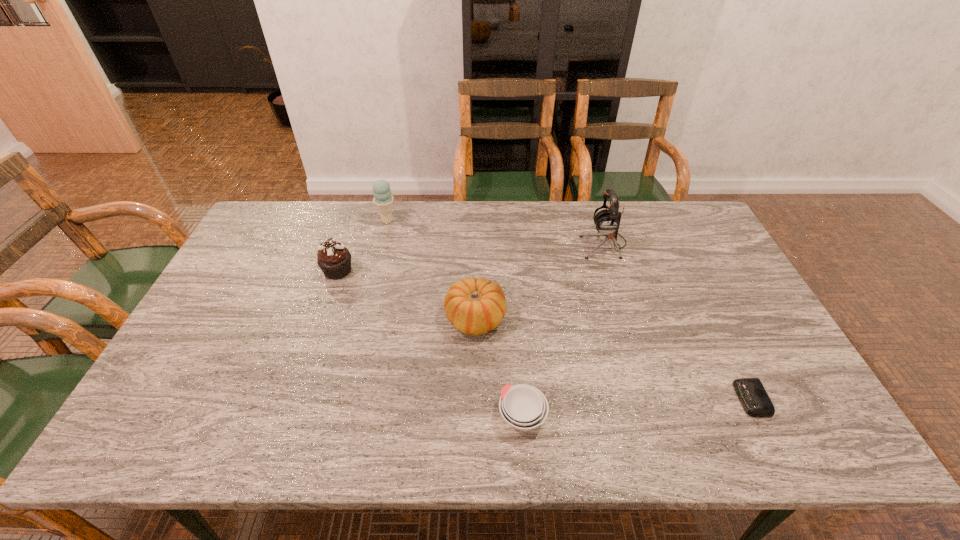
In order to click on the second object from right to left in this screenshot , I will do `click(607, 221)`.

Find the location of `the tallest object`. the tallest object is located at coordinates (607, 221).

At what (x,y) coordinates should I click in order to perform the action: click on the farthest object. Please return your answer as a coordinate pair (x, y). Looking at the image, I should click on (383, 200).

Where is `the fifth object from right to left`? This screenshot has width=960, height=540. the fifth object from right to left is located at coordinates (383, 200).

This screenshot has width=960, height=540. Identify the location of the fourth farthest object. (474, 307).

Identify the location of the leftmost object. The height and width of the screenshot is (540, 960). (334, 259).

The height and width of the screenshot is (540, 960). Find the location of `the fourth nearest object`. the fourth nearest object is located at coordinates (334, 259).

What are the coordinates of `the fifth tallest object` in the screenshot? It's located at (524, 407).

At what (x,y) coordinates should I click in order to perform the action: click on the rightmost object. Please return your answer as a coordinate pair (x, y). Looking at the image, I should click on (750, 391).

Locate an element on the screen. The height and width of the screenshot is (540, 960). alarm clock is located at coordinates (750, 391).